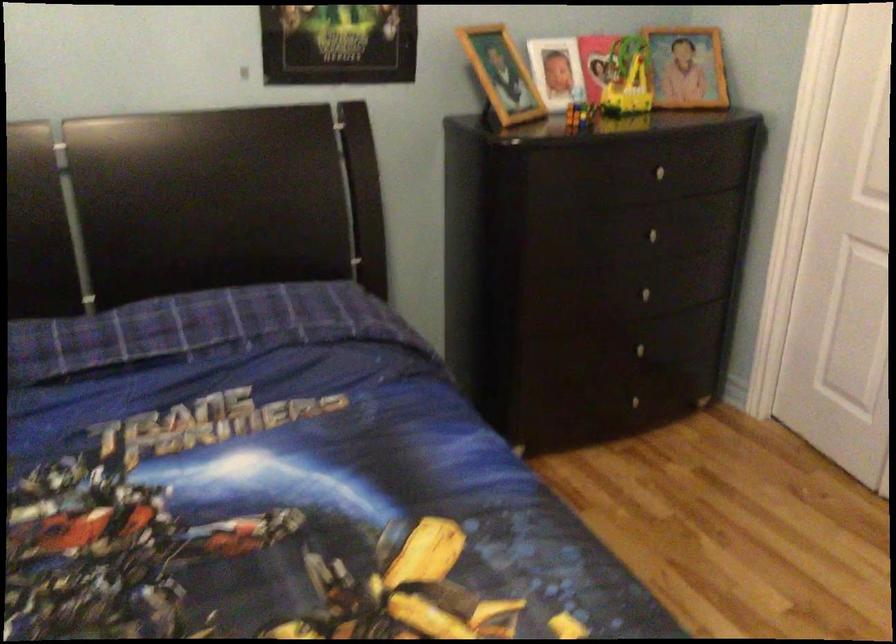
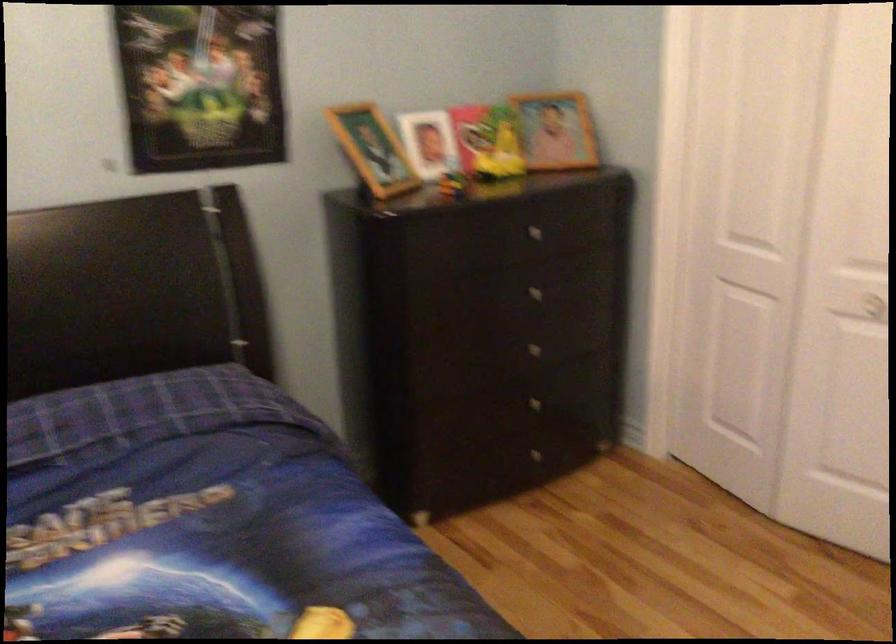
Where in the second image is the point corresponding to point (690, 69) from the first image?

(556, 129)